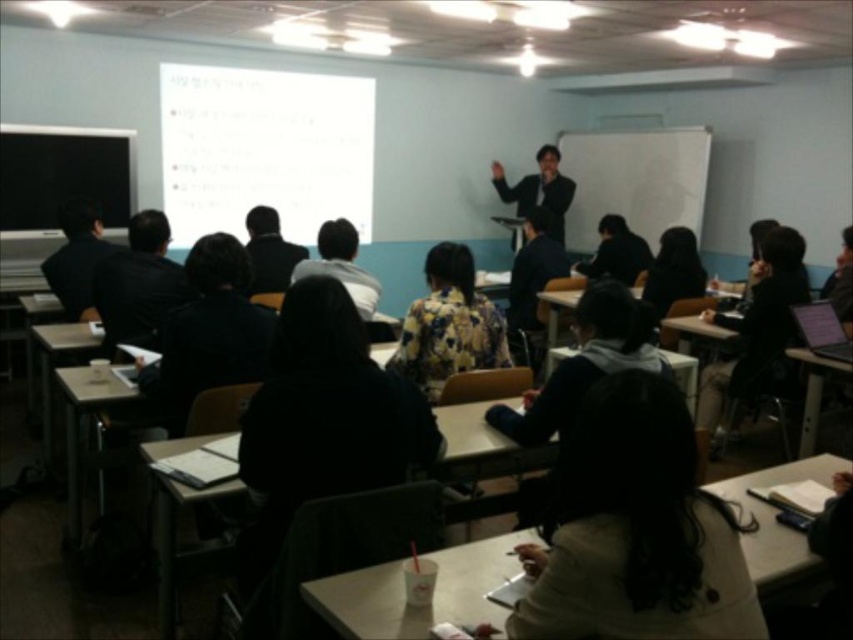
Can you confirm if floral fabric blouse at center is positioned to the left of floral fabric jacket at center?

Incorrect, floral fabric blouse at center is not on the left side of floral fabric jacket at center.

Is point (428, 292) closer to viewer compared to point (360, 308)?

No, (428, 292) is further to viewer.

Locate an element on the screen. floral fabric blouse at center is located at coordinates (450, 324).

Between black matte jacket at left and black suit at center, which one has less height?

black matte jacket at left is shorter.

Is black matte jacket at left positioned in front of black suit at center?

Yes.

Measure the distance between black matte jacket at left and camera.

The distance of black matte jacket at left from camera is 11.86 feet.

Where is `black matte jacket at left`? This screenshot has height=640, width=853. black matte jacket at left is located at coordinates (77, 257).

Looking at this image, who is positioned more to the left, black matte jacket at lower center or black matte jacket at left?

Positioned to the left is black matte jacket at left.

Is black matte jacket at lower center below black matte jacket at left?

Yes, black matte jacket at lower center is below black matte jacket at left.

Is point (579, 632) closer to viewer compared to point (91, 282)?

Yes, it is in front of point (91, 282).

The width and height of the screenshot is (853, 640). What are the coordinates of `black matte jacket at lower center` in the screenshot? It's located at (634, 529).